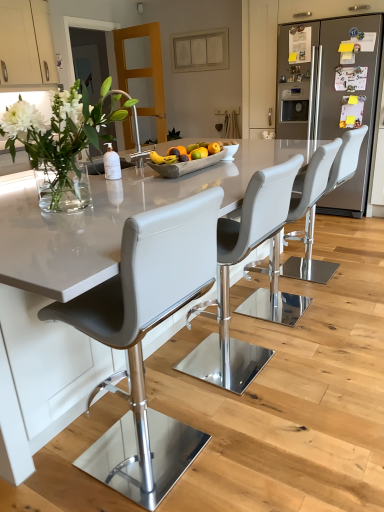
You are a GUI agent. You are given a task and a screenshot of the screen. Output one action in this format:
    pyautogui.click(x=<x>, y=<y>)
    Task: Click on the free space behind matte gray chair at center, which ranks as the fourth chair in back-to-front order
    The image size is (384, 512).
    Given the screenshot: What is the action you would take?
    pyautogui.click(x=166, y=392)